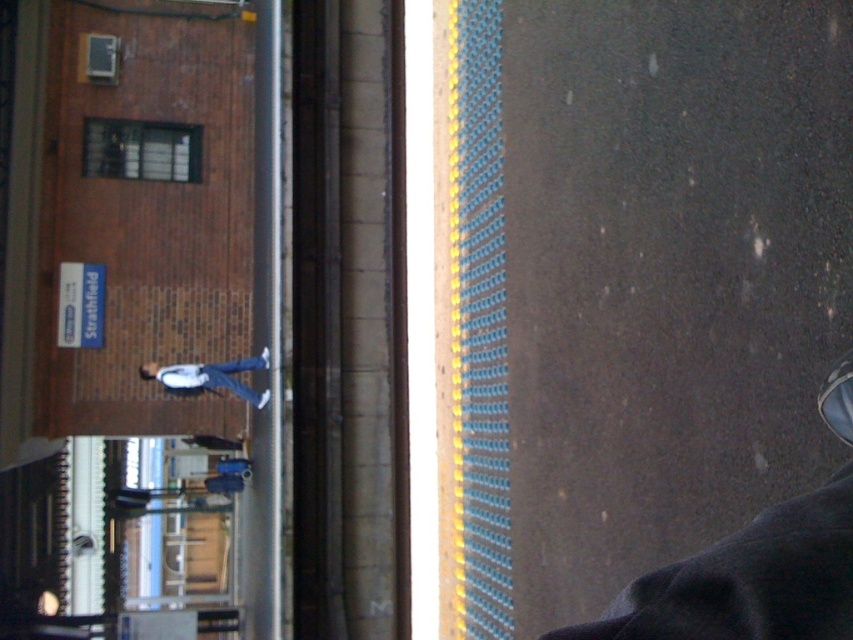
Between brick textured window at upper left and light blue jeans at center, which one is positioned lower?

light blue jeans at center

Between brick textured window at upper left and light blue jeans at center, which one has more height?

With more height is brick textured window at upper left.

Between point (200, 145) and point (253, 358), which one is positioned behind?

Point (200, 145)

Image resolution: width=853 pixels, height=640 pixels. Find the location of `brick textured window at upper left`. brick textured window at upper left is located at coordinates (141, 150).